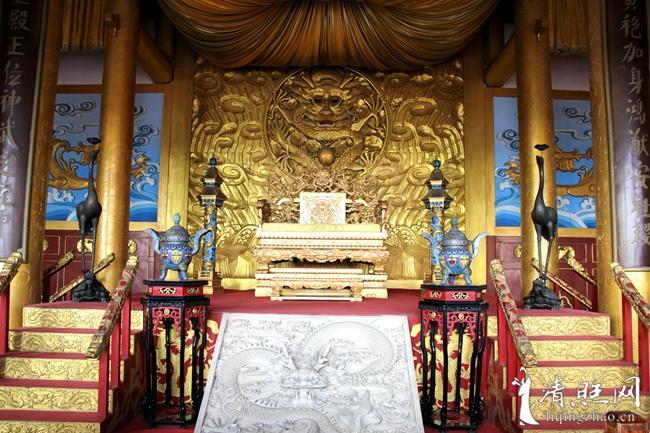
This screenshot has height=433, width=650. I want to click on golden bench, so click(x=328, y=239).